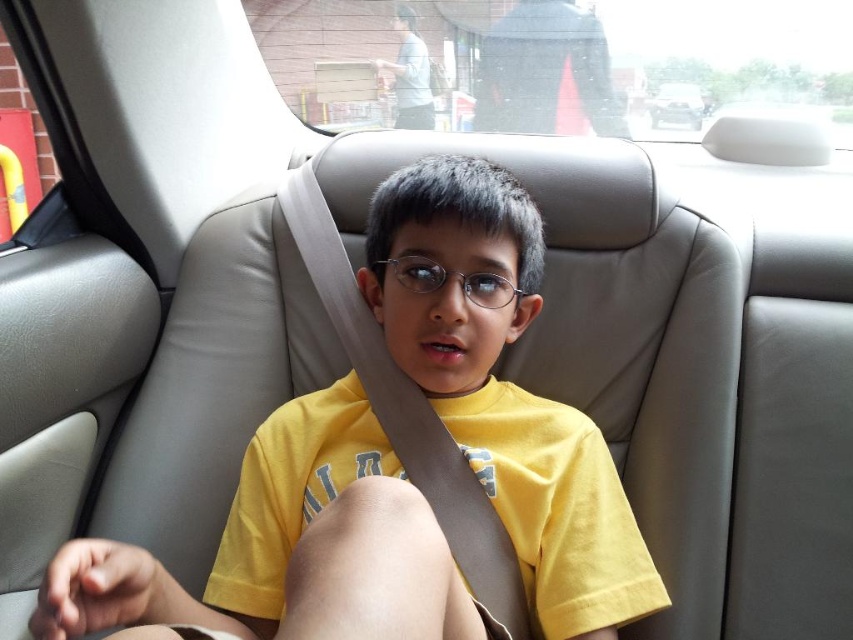
Between black fabric bag at upper center and metallic silver glasses at center, which one is positioned lower?

Positioned lower is metallic silver glasses at center.

Is black fabric bag at upper center wider than metallic silver glasses at center?

Indeed, black fabric bag at upper center has a greater width compared to metallic silver glasses at center.

Does point (494, 35) lie in front of point (421, 257)?

No, it is not.

Where is `black fabric bag at upper center`? The height and width of the screenshot is (640, 853). black fabric bag at upper center is located at coordinates pos(544,70).

Between point (503, 285) and point (701, 122), which one is positioned in front?

Point (503, 285)

Between metallic silver glasses at center and metallic silver car at upper center, which one is positioned higher?

metallic silver car at upper center is above.

Image resolution: width=853 pixels, height=640 pixels. What are the coordinates of `metallic silver glasses at center` in the screenshot? It's located at (445, 278).

Can you confirm if yellow matte shirt at center is positioned below black fabric bag at upper center?

Correct, yellow matte shirt at center is located below black fabric bag at upper center.

Does yellow matte shirt at center have a smaller size compared to black fabric bag at upper center?

Incorrect, yellow matte shirt at center is not smaller in size than black fabric bag at upper center.

Who is more forward, (579, 515) or (479, 125)?

Positioned in front is point (579, 515).

Identify the location of yellow matte shirt at center. The image size is (853, 640). (506, 392).